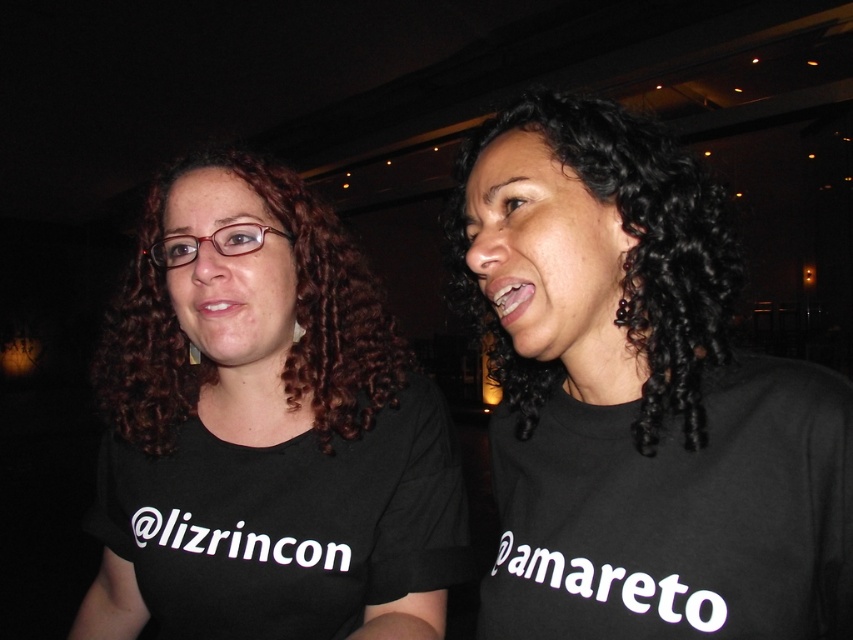
You are a photographer trying to capture a closeup of the black curly hair at center and the black matte shirt at center. Which object should you zoom in on to ensure it takes up more of the frame?

The black curly hair at center occupies more space than the black matte shirt at center, so you should zoom in on the black curly hair at center to ensure it takes up more of the frame.

You are holding a flashlight that has a maximum effective range of 20 inches. You want to illuminate the black matte shirt at center. Can the flashlight reach it?

The black matte shirt at center is 19.78 inches away from viewer. Since the flashlight has a maximum effective range of 20 inches, it can reach the black matte shirt at center.